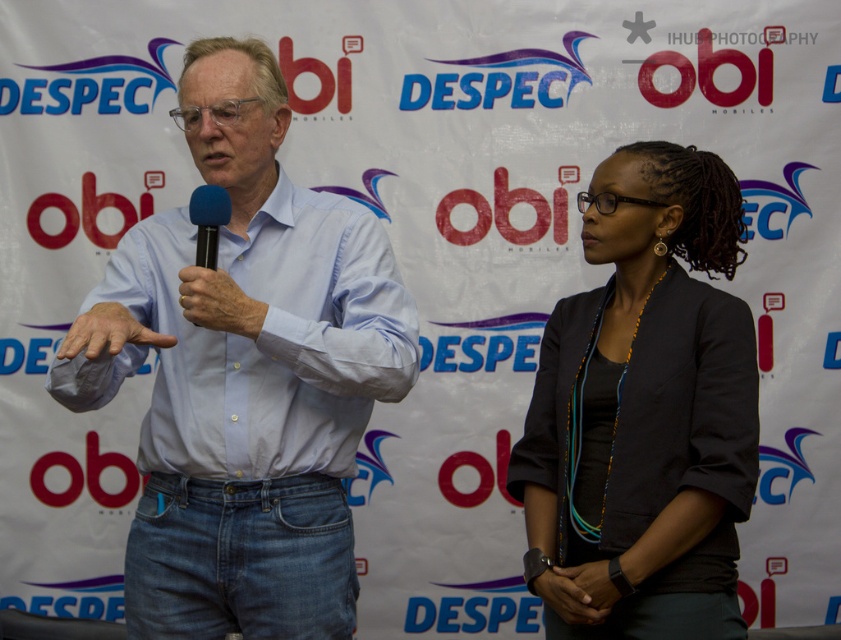
Question: Which object is the closest to the dark gray blazer at center?

Choices:
 (A) black matte microphone at center
 (B) light blue shirt at center

Answer: (B)

Question: Does dark gray blazer at center have a smaller size compared to black matte microphone at center?

Choices:
 (A) yes
 (B) no

Answer: (B)

Question: Does light blue shirt at center have a greater width compared to dark gray blazer at center?

Choices:
 (A) no
 (B) yes

Answer: (B)

Question: Considering the real-world distances, which object is closest to the dark gray blazer at center?

Choices:
 (A) light blue shirt at center
 (B) black matte microphone at center

Answer: (A)

Question: Which point is closer to the camera taking this photo?

Choices:
 (A) (319, 403)
 (B) (194, 204)

Answer: (B)

Question: Considering the relative positions of light blue shirt at center and black matte microphone at center in the image provided, where is light blue shirt at center located with respect to black matte microphone at center?

Choices:
 (A) below
 (B) above

Answer: (A)